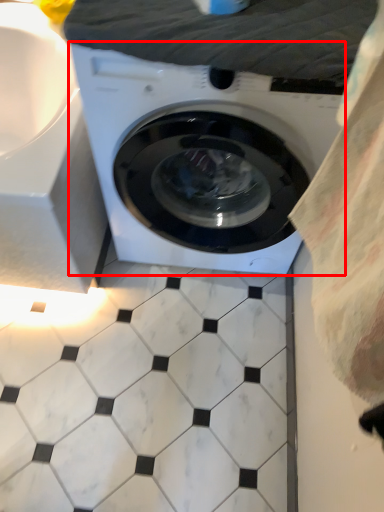
Question: From the image's perspective, where is washing machine (annotated by the red box) located in relation to sheet in the image?

Choices:
 (A) above
 (B) below

Answer: (B)